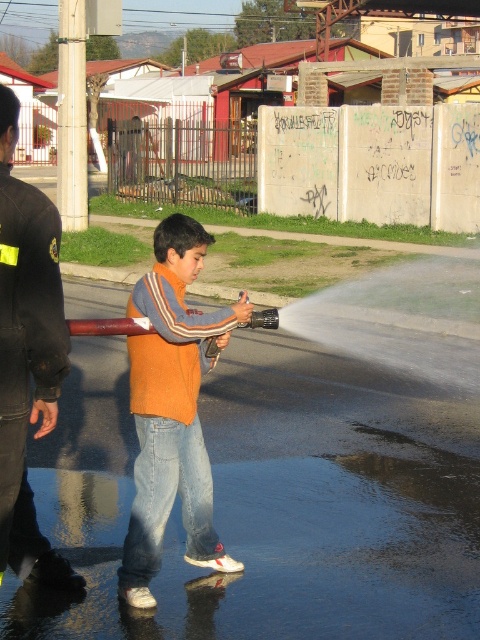
Question: Which point is closer to the camera taking this photo?

Choices:
 (A) (146, 348)
 (B) (16, 280)

Answer: (B)

Question: Does orange fleece at center have a smaller size compared to black leather jacket at left?

Choices:
 (A) no
 (B) yes

Answer: (B)

Question: Does orange fleece at center appear on the left side of black leather jacket at left?

Choices:
 (A) no
 (B) yes

Answer: (A)

Question: Is orange fleece at center below black leather jacket at left?

Choices:
 (A) no
 (B) yes

Answer: (B)